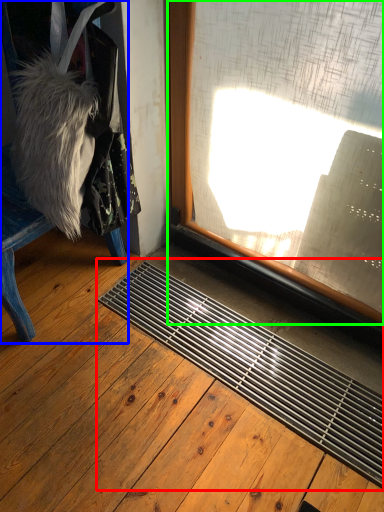
Question: Based on their relative distances, which object is farther from doormat (highlighted by a red box)? Choose from furniture (highlighted by a blue box) and window (highlighted by a green box).

Choices:
 (A) furniture
 (B) window

Answer: (A)